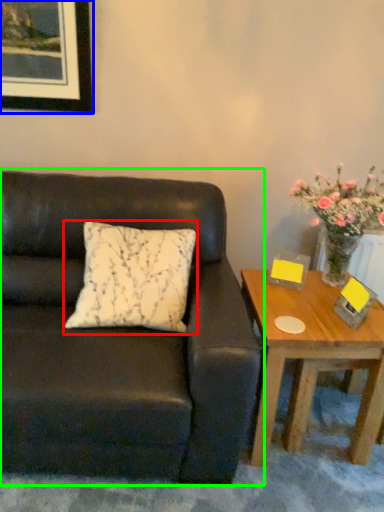
Question: Which is nearer to the pillow (highlighted by a red box)? picture frame (highlighted by a blue box) or studio couch (highlighted by a green box).

Choices:
 (A) picture frame
 (B) studio couch

Answer: (B)